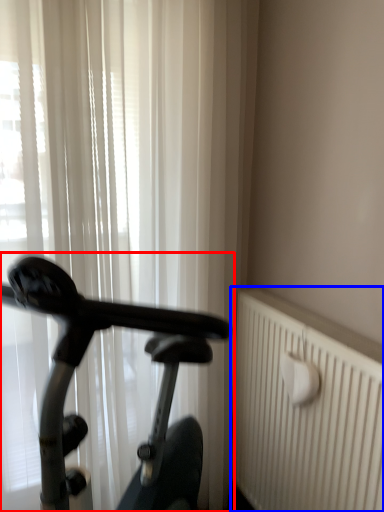
Question: Which point is closer to the camera, bicycle (highlighted by a red box) or radiator (highlighted by a blue box)?

Choices:
 (A) bicycle
 (B) radiator

Answer: (A)